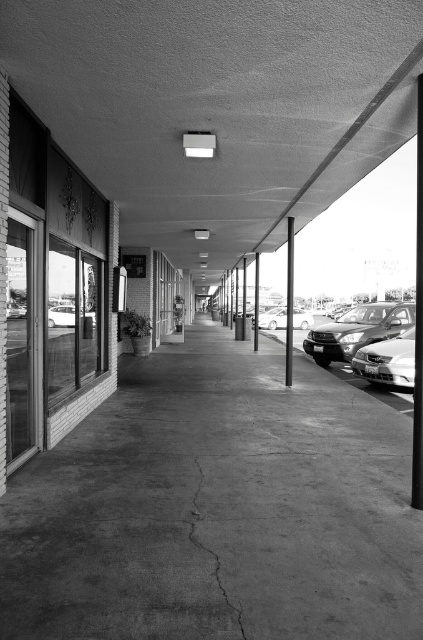
Question: Among these points, which one is nearest to the camera?

Choices:
 (A) (214, 502)
 (B) (389, 336)
 (C) (264, 323)

Answer: (A)

Question: Is shiny silver sedan at center-right thinner than cracked concrete at center?

Choices:
 (A) yes
 (B) no

Answer: (B)

Question: In this image, where is cracked concrete at center located relative to smooth concrete pillar at center?

Choices:
 (A) right
 (B) left

Answer: (B)

Question: Does cracked concrete at center come in front of smooth concrete pillar at center?

Choices:
 (A) yes
 (B) no

Answer: (A)

Question: Among these points, which one is farthest from the camera?

Choices:
 (A) (293, 276)
 (B) (409, 346)
 (C) (47, 323)

Answer: (A)

Question: Among these objects, which one is nearest to the camera?

Choices:
 (A) shiny silver sedan at center-right
 (B) metallic silver car at center
 (C) cracked concrete at center

Answer: (C)